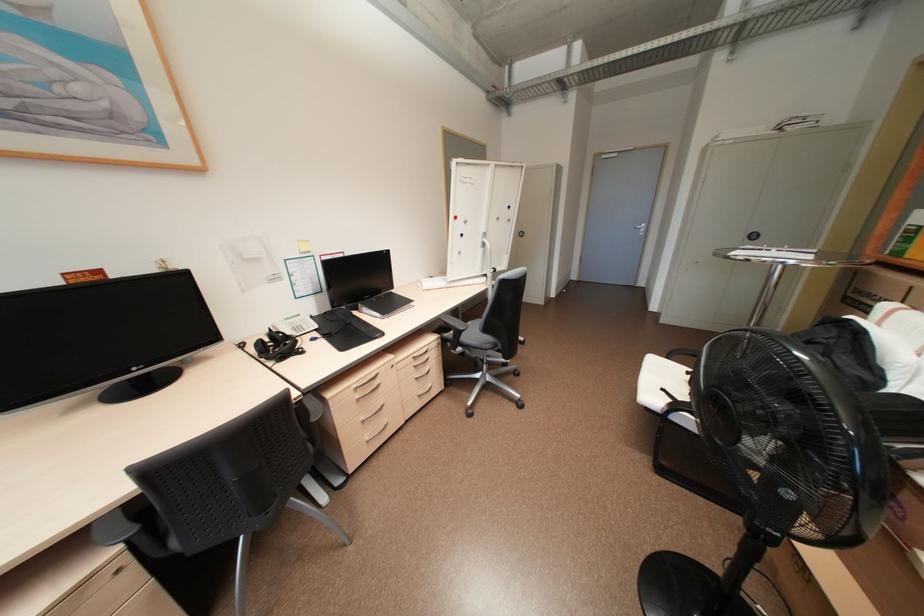
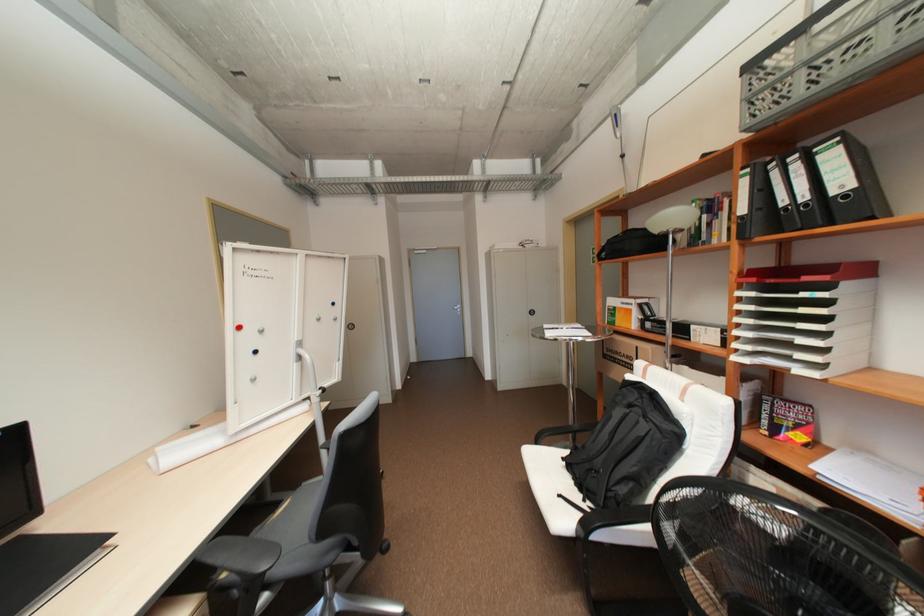
In the second image, find the point that corresponds to (x=852, y=300) in the first image.

(611, 355)